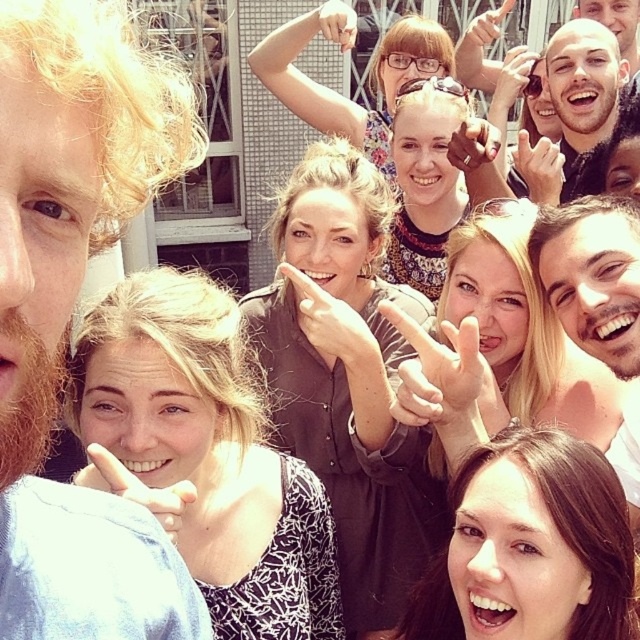
You are a photographer trying to capture a candid shot of the smooth skin face at center without including the bearded man at left in the frame. Given their current positions, is this possible?

The bearded man at left is positioned on the left side of smooth skin face at center, so if you angle your camera to avoid the bearded man at left, you can capture the smooth skin face at center alone.

You are a photographer trying to capture a group photo of the bearded man at left and the smooth skin face at center. Given their sizes, which one should you focus on to ensure they appear balanced in the photo?

The bearded man at left is larger in size compared to the smooth skin face at center. To balance their sizes in the photo, focus more on the smooth skin face at center to compensate for its smaller size.